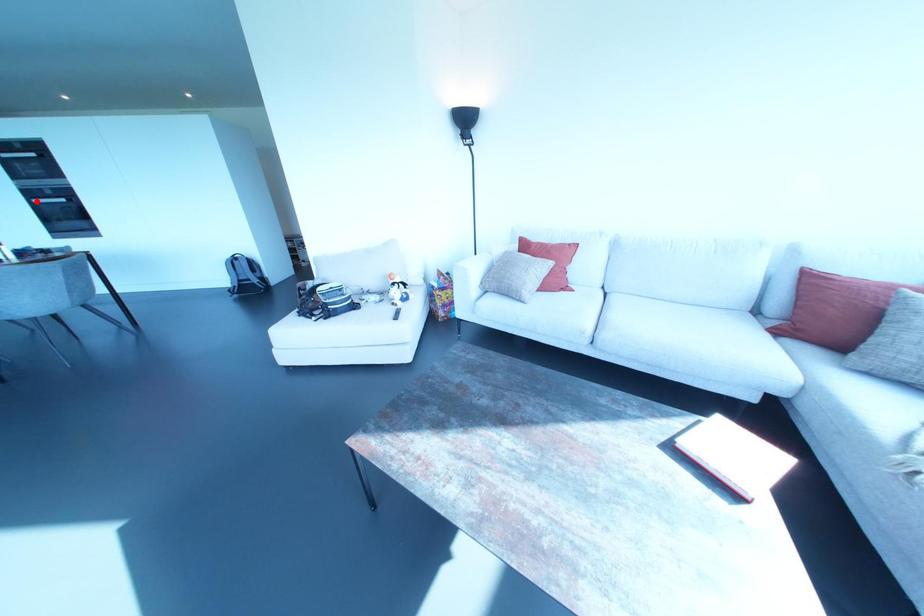
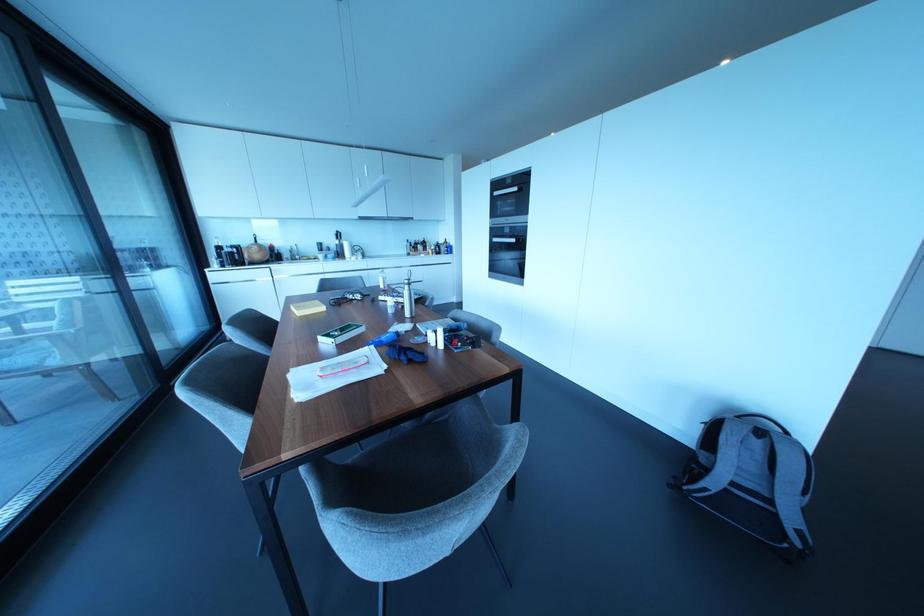
The point at the highlighted location is marked in the first image. Where is the corresponding point in the second image?

(493, 238)